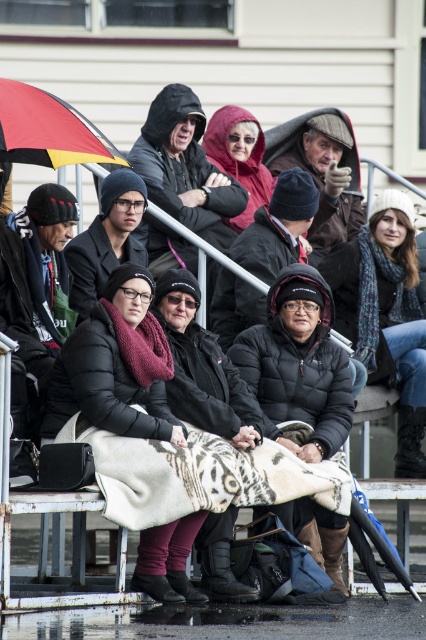
Does black quilted jacket at lower center have a smaller size compared to red/yellow striped umbrella at upper left?

Indeed, black quilted jacket at lower center has a smaller size compared to red/yellow striped umbrella at upper left.

Is point (281, 278) behind point (0, 93)?

Yes.

Which is behind, point (328, 324) or point (20, 141)?

Positioned behind is point (328, 324).

At what (x,y) coordinates should I click in order to perform the action: click on black quilted jacket at lower center. Please return your answer as a coordinate pair (x, y). Looking at the image, I should click on (298, 364).